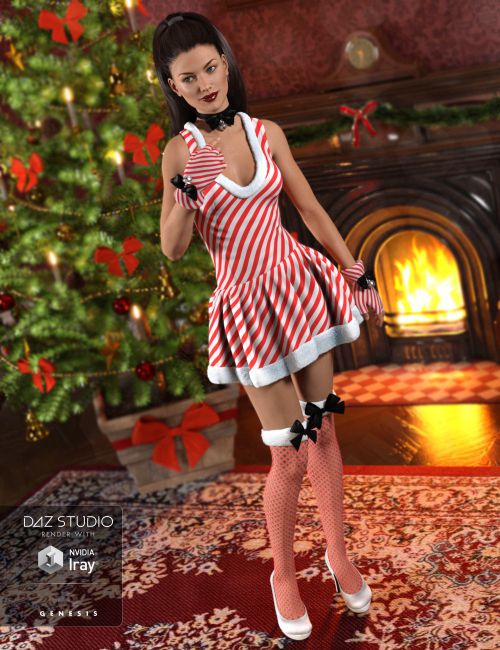
Locate an element on the screen. carpet is located at coordinates (422, 558).